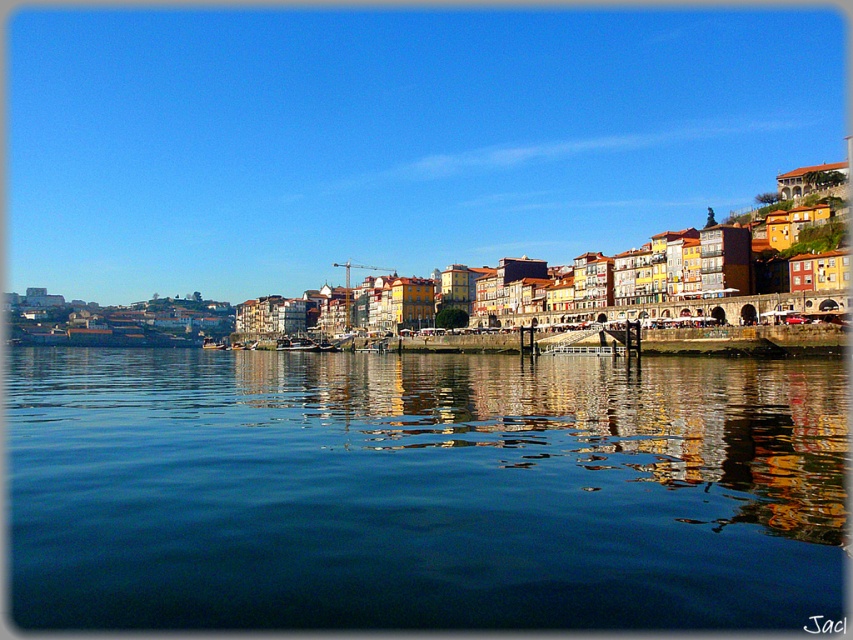
You are a tourist standing on the riverside and want to take a photo of the transparent blue water at center and the wooden boat at center. Which object should you focus on first if you want to capture both in one frame without moving the camera?

You should focus on the transparent blue water at center first because it is larger in size than the wooden boat at center, so it will take up more space in the frame.

You are standing on the riverside and want to take a photo of the wooden boat at center and the transparent blue water at center. Which object should you focus on first if you want to capture both in one shot without moving the camera?

You should focus on the wooden boat at center first because the transparent blue water at center is located below it, so adjusting the focus to the boat will ensure the water is also in the frame.

You are a tourist standing on the riverside and want to take a photo of both the wooden boat at center and the wooden boat at lower left. However, you notice that one boat is blocking the view of the other. Which boat is blocking the view of the other?

The wooden boat at center is positioned over the wooden boat at lower left, so the wooden boat at center is blocking the view of the wooden boat at lower left.